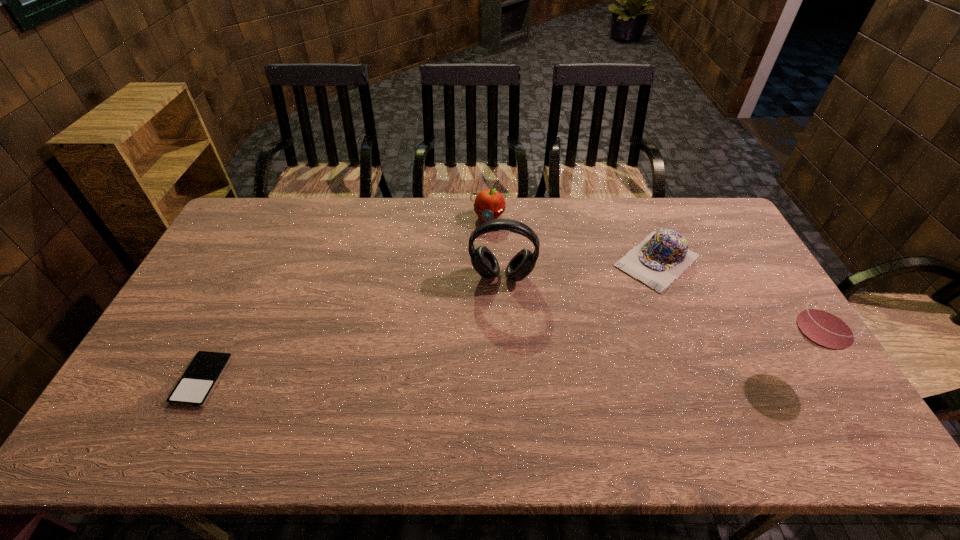
Find the location of `apple positioned at the far edge`. apple positioned at the far edge is located at coordinates (489, 204).

Locate an element on the screen. iPod that is at the near edge is located at coordinates (194, 388).

What are the coordinates of `wineglass situated at the near edge` in the screenshot? It's located at (828, 324).

Where is `object that is at the left edge`? The height and width of the screenshot is (540, 960). object that is at the left edge is located at coordinates (194, 388).

The width and height of the screenshot is (960, 540). Find the location of `wineglass that is at the right edge`. wineglass that is at the right edge is located at coordinates (828, 324).

What are the coordinates of `cap at the right edge` in the screenshot? It's located at (661, 258).

Image resolution: width=960 pixels, height=540 pixels. In order to click on object situated at the near left corner in this screenshot , I will do `click(194, 388)`.

Identify the location of object at the far right corner. Image resolution: width=960 pixels, height=540 pixels. (661, 258).

Where is `object at the near right corner`? Image resolution: width=960 pixels, height=540 pixels. object at the near right corner is located at coordinates (828, 324).

Identify the location of vacant space at the far edge of the desktop. (613, 236).